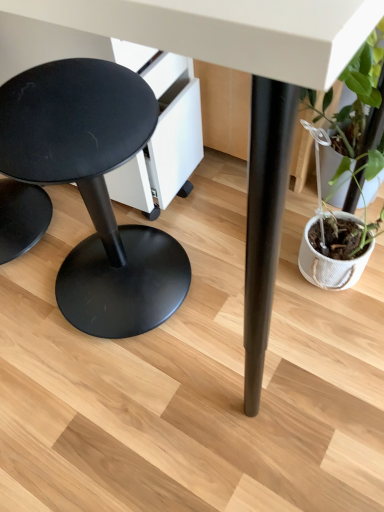
Find the location of a particular element. The width and height of the screenshot is (384, 512). green leafy plant in woven pot at right is located at coordinates (334, 258).

Image resolution: width=384 pixels, height=512 pixels. Describe the element at coordinates (334, 258) in the screenshot. I see `green leafy plant in woven pot at right` at that location.

Locate an element on the screen. The image size is (384, 512). matte black stool at left is located at coordinates pyautogui.click(x=94, y=189).

What is the approximate height of matte black stool at left?

It is 25.84 inches.

What do you see at coordinates (94, 189) in the screenshot? I see `matte black stool at left` at bounding box center [94, 189].

At what (x,y) coordinates should I click in order to perform the action: click on green leafy plant in woven pot at right. Please return your answer as a coordinate pair (x, y). This screenshot has width=384, height=512. Looking at the image, I should click on (334, 258).

Considering the relative positions of green leafy plant in woven pot at right and matte black stool at left in the image provided, is green leafy plant in woven pot at right to the right of matte black stool at left from the viewer's perspective?

Yes, green leafy plant in woven pot at right is to the right of matte black stool at left.

Which object is closer to the camera taking this photo, green leafy plant in woven pot at right or matte black stool at left?

matte black stool at left.

Which is behind, point (360, 55) or point (173, 247)?

The point (173, 247) is more distant.

From the image's perspective, between green leafy plant in woven pot at right and matte black stool at left, who is located below?

matte black stool at left is shown below in the image.

From a real-world perspective, is green leafy plant in woven pot at right under matte black stool at left?

Correct, in the physical world, green leafy plant in woven pot at right is lower than matte black stool at left.

In terms of width, does green leafy plant in woven pot at right look wider or thinner when compared to matte black stool at left?

green leafy plant in woven pot at right is thinner than matte black stool at left.

Can you confirm if green leafy plant in woven pot at right is taller than matte black stool at left?

No.

Considering the relative sizes of green leafy plant in woven pot at right and matte black stool at left in the image provided, is green leafy plant in woven pot at right smaller than matte black stool at left?

Yes, green leafy plant in woven pot at right is smaller than matte black stool at left.

Would you say green leafy plant in woven pot at right contains matte black stool at left?

Definitely not — matte black stool at left is not inside green leafy plant in woven pot at right.

Would you consider green leafy plant in woven pot at right to be distant from matte black stool at left?

Actually, green leafy plant in woven pot at right and matte black stool at left are a little close together.

Is green leafy plant in woven pot at right looking in the opposite direction of matte black stool at left?

green leafy plant in woven pot at right does not have its back to matte black stool at left.

In order to click on stool below the green leafy plant in woven pot at right (from the image's perspective) in this screenshot , I will do `click(94, 189)`.

Is matte black stool at left at the left side of green leafy plant in woven pot at right?

Indeed, matte black stool at left is positioned on the left side of green leafy plant in woven pot at right.

Relative to green leafy plant in woven pot at right, is matte black stool at left in front or behind?

matte black stool at left is in front of green leafy plant in woven pot at right.

Is point (81, 133) positioned behind point (370, 51)?

No, it is not.

From the image's perspective, is matte black stool at left below green leafy plant in woven pot at right?

Yes, from the image's perspective, matte black stool at left is beneath green leafy plant in woven pot at right.

From a real-world perspective, who is located higher, matte black stool at left or green leafy plant in woven pot at right?

From a 3D spatial view, matte black stool at left is above.

Looking at their sizes, would you say matte black stool at left is wider or thinner than green leafy plant in woven pot at right?

Clearly, matte black stool at left has more width compared to green leafy plant in woven pot at right.

Who is shorter, matte black stool at left or green leafy plant in woven pot at right?

green leafy plant in woven pot at right is shorter.

Consider the image. Considering the sizes of objects matte black stool at left and green leafy plant in woven pot at right in the image provided, who is bigger, matte black stool at left or green leafy plant in woven pot at right?

Bigger between the two is matte black stool at left.

Is matte black stool at left completely or partially outside of green leafy plant in woven pot at right?

Yes.

Are matte black stool at left and green leafy plant in woven pot at right far apart?

They are positioned close to each other.

Is matte black stool at left facing towards green leafy plant in woven pot at right?

No.

The width and height of the screenshot is (384, 512). I want to click on houseplant above the matte black stool at left (from the image's perspective), so click(x=334, y=258).

In the image, there is a matte black stool at left. Identify the location of houseplant above it (from the image's perspective). The height and width of the screenshot is (512, 384). pos(334,258).

I want to click on houseplant located behind the matte black stool at left, so click(334, 258).